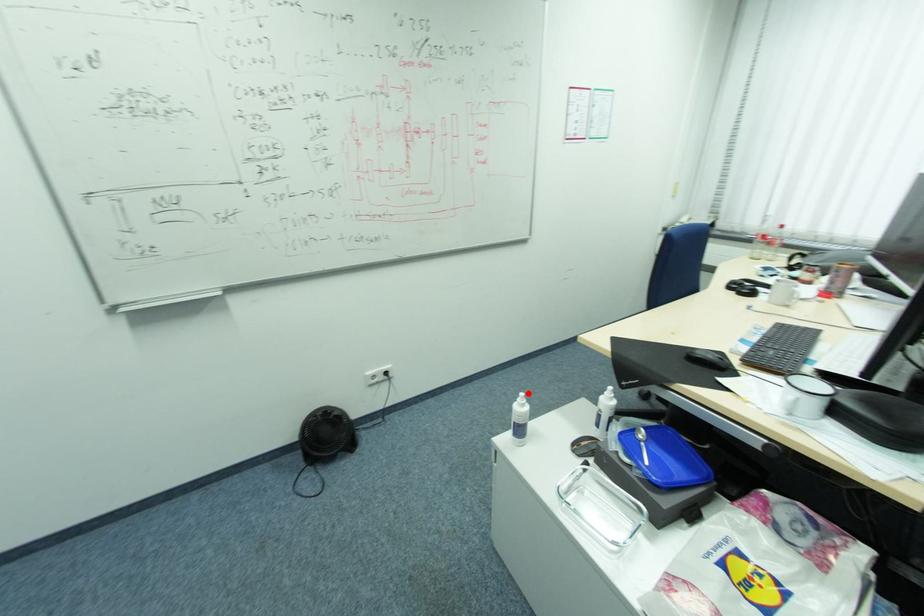
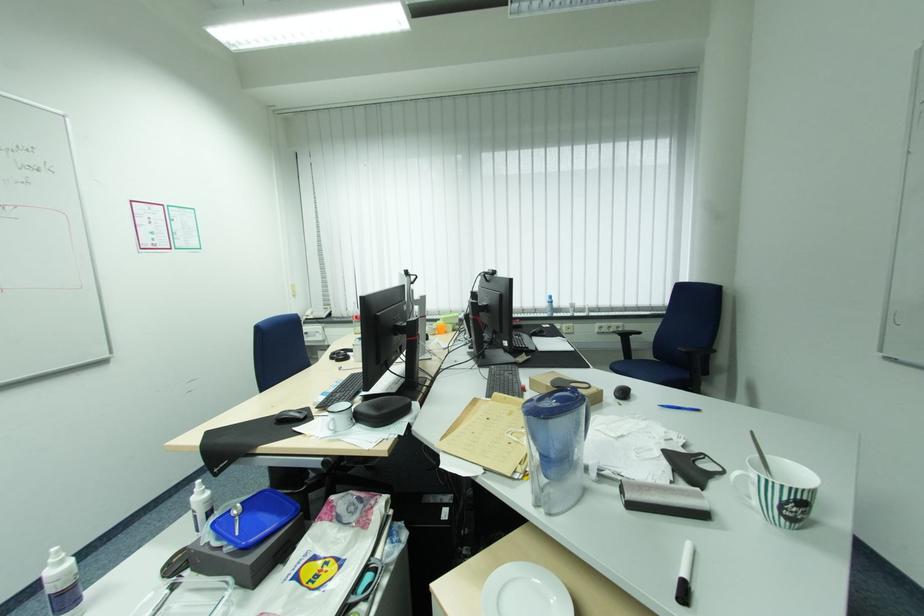
Question: I am providing you with two images of the same scene from different viewpoints. Image1 has a red point marked. In image2, the corresponding 3D location appears at what relative position? Reply with the corresponding letter.

Choices:
 (A) Closer
 (B) Farther

Answer: (B)